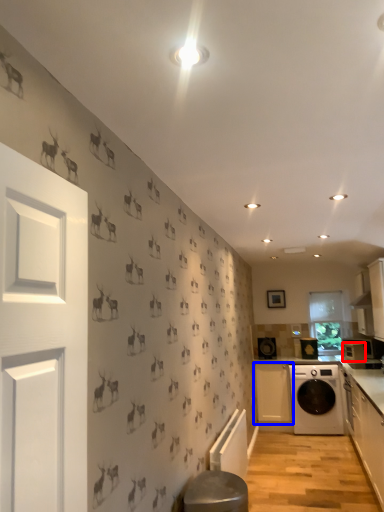
Question: Which point is further to the camera, appliance (highlighted by a red box) or cabinetry (highlighted by a blue box)?

Choices:
 (A) appliance
 (B) cabinetry

Answer: (B)